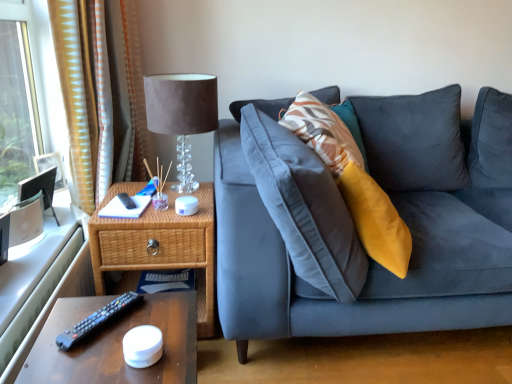
The image size is (512, 384). I want to click on free space to the left of black plastic remote at lower left, so click(67, 319).